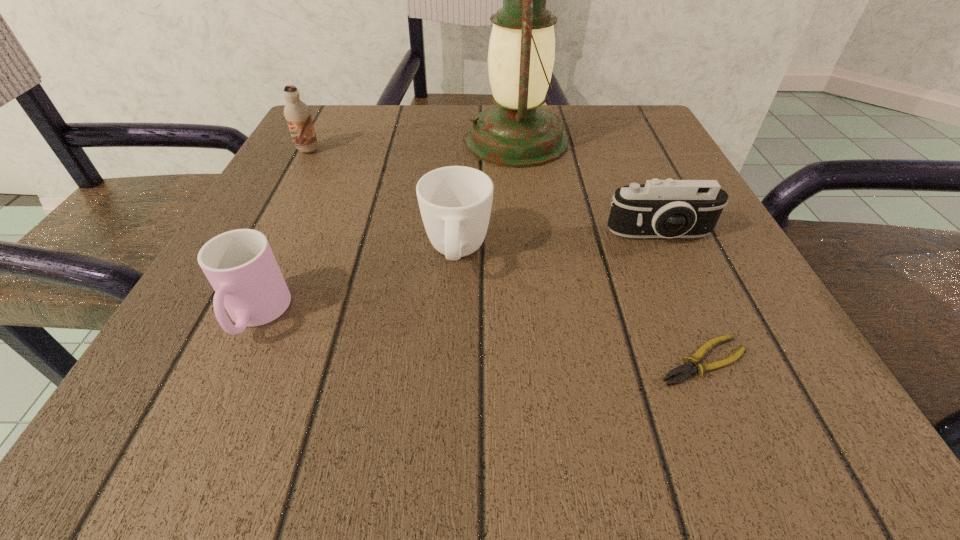
Identify the location of object present at the far left corner. Image resolution: width=960 pixels, height=540 pixels. (298, 115).

This screenshot has height=540, width=960. I want to click on object at the near right corner, so click(x=686, y=370).

Find the location of a particular element. The height and width of the screenshot is (540, 960). free location at the far edge of the desktop is located at coordinates (408, 114).

In the image, there is a desktop. Identify the location of blank space at the near edge. (422, 375).

The width and height of the screenshot is (960, 540). In the image, there is a desktop. Identify the location of vacant space at the left edge. (293, 212).

Image resolution: width=960 pixels, height=540 pixels. Find the location of `vacant space at the right edge of the desktop`. vacant space at the right edge of the desktop is located at coordinates [612, 195].

In the image, there is a desktop. Where is `vacant region at the far left corner`? This screenshot has width=960, height=540. vacant region at the far left corner is located at coordinates (355, 140).

Find the location of a particular element. This screenshot has width=960, height=540. blank space at the near left corner is located at coordinates (274, 398).

Locate an element on the screen. This screenshot has height=540, width=960. vacant space at the far right corner is located at coordinates (616, 116).

Find the location of `free space at the near right corner`. free space at the near right corner is located at coordinates (780, 382).